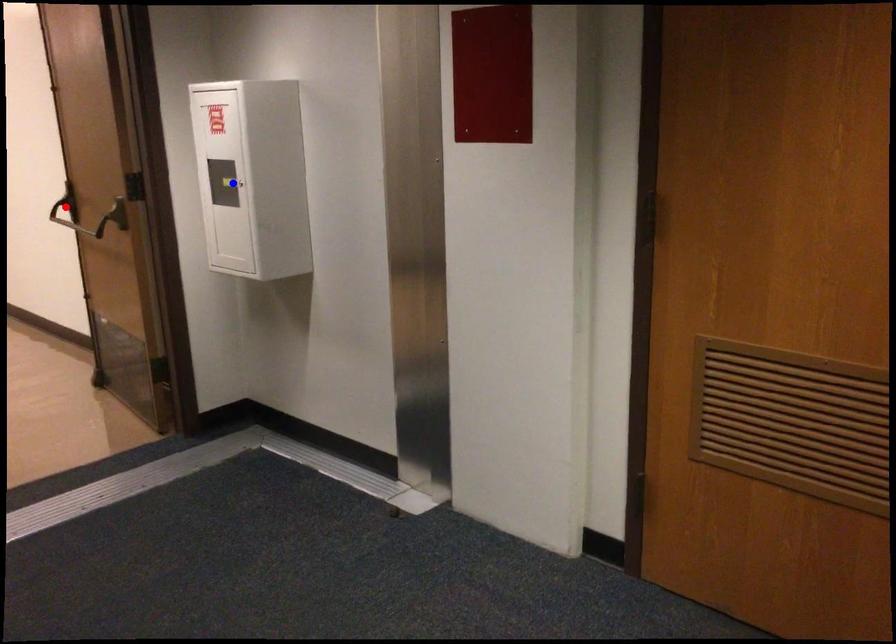
Question: In the image, two points are highlighted. Which point is nearer to the camera? Reply with the corresponding letter.

Choices:
 (A) blue point
 (B) red point

Answer: (A)